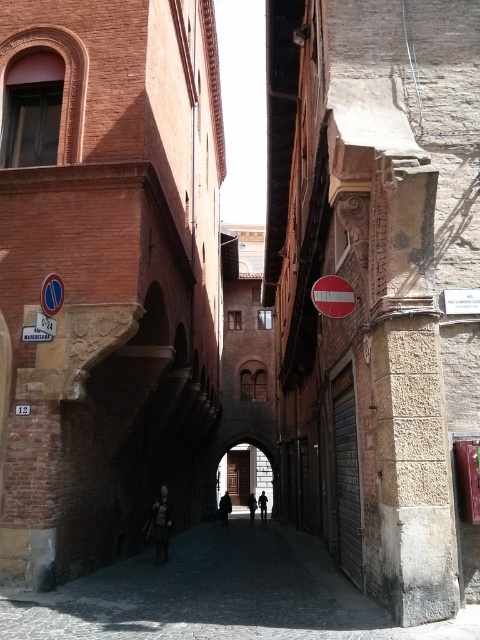
Question: Can you confirm if blue plastic sign at upper left is smaller than silhouette figure at center?

Choices:
 (A) no
 (B) yes

Answer: (B)

Question: Which of the following is the closest to the observer?

Choices:
 (A) dark brown leather coat at center
 (B) silhouette figure at center
 (C) dark gray fabric jacket at center
 (D) black leather jacket at center

Answer: (C)

Question: Does blue plastic sign at upper left appear on the left side of dark brown leather coat at center?

Choices:
 (A) no
 (B) yes

Answer: (B)

Question: Is blue plastic sign at upper left smaller than silhouette figure at center?

Choices:
 (A) no
 (B) yes

Answer: (B)

Question: Which point is closer to the camera?

Choices:
 (A) (163, 515)
 (B) (252, 497)
 (C) (332, 314)

Answer: (C)

Question: Among these objects, which one is farthest from the camera?

Choices:
 (A) red plastic stop sign at center
 (B) dark gray fabric jacket at center
 (C) silhouette figure at center

Answer: (C)